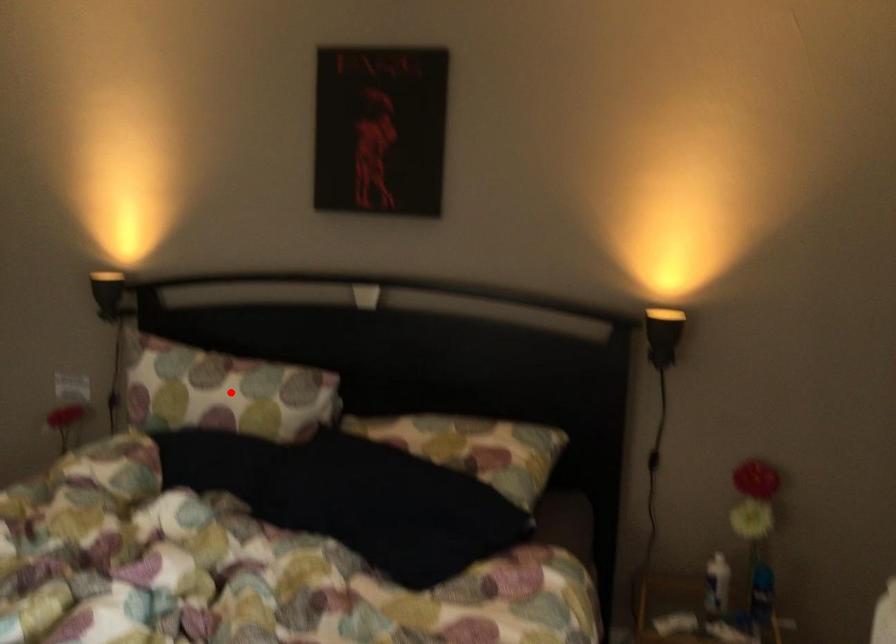
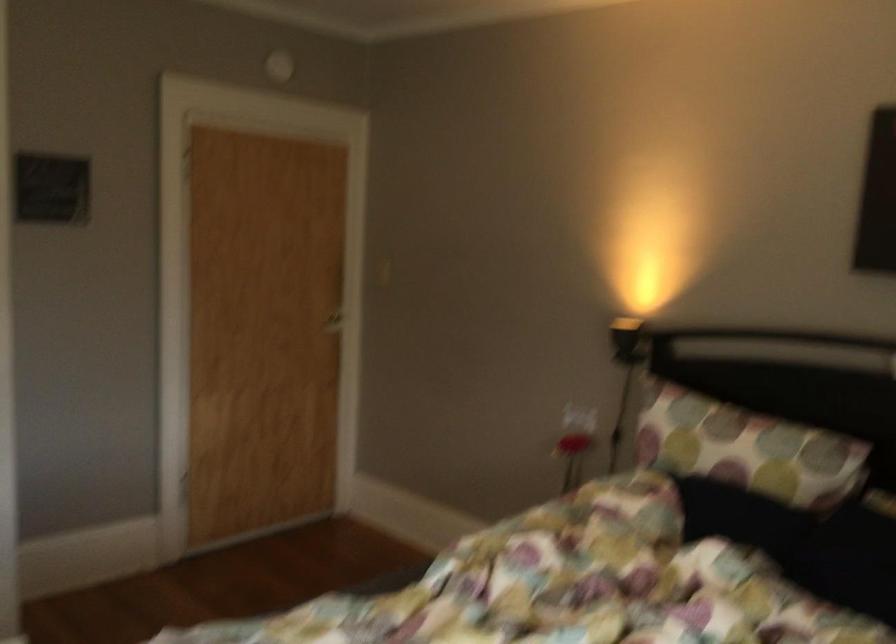
Question: I am providing you with two images of the same scene from different viewpoints. A red point is marked on the first image. Is the red point's position out of view in image 2?

Choices:
 (A) Yes
 (B) No

Answer: (B)